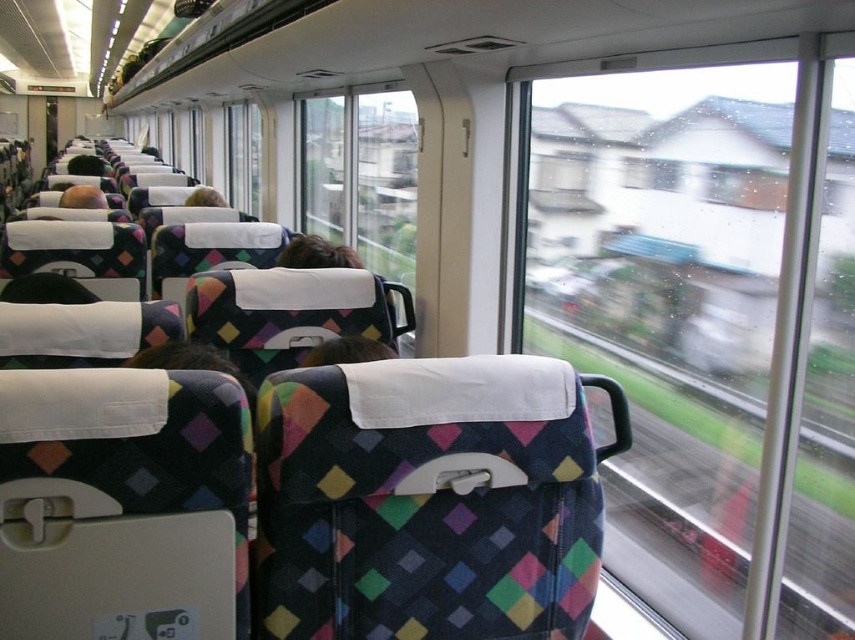
You are sitting in the train carriage and want to know the relative position of two points marked on the window. Which point is closer to you, point at coordinates (670, 152) or point at coordinates (60, 202)?

Point at coordinates (670, 152) is in front of point at coordinates (60, 202), so it is closer to you.

You are a passenger sitting in the train carriage and want to check the view outside. You have a transparent glass window at center and a matte black hair at left. Which object would allow you to see the passing landscape better?

The transparent glass window at center is larger in size than the matte black hair at left, so you can see the passing landscape better through the transparent glass window at center.